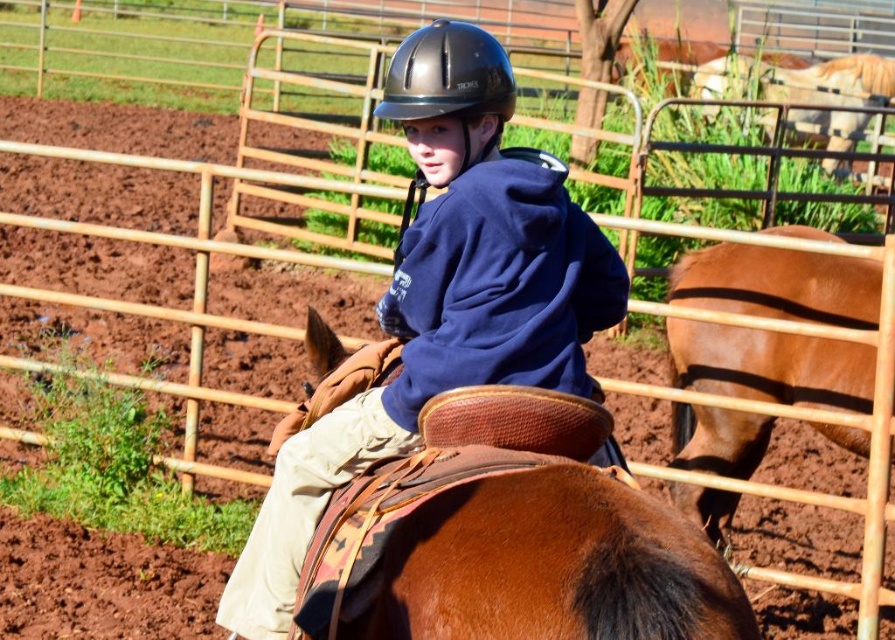
Question: Which object is the farthest from the glossy black helmet at center?

Choices:
 (A) matte black helmet at center
 (B) brown leather saddle at center

Answer: (B)

Question: Can you confirm if brown leather horse at right is positioned above glossy black helmet at center?

Choices:
 (A) yes
 (B) no

Answer: (B)

Question: Estimate the real-world distances between objects in this image. Which object is closer to the brown leather saddle at center?

Choices:
 (A) matte black helmet at center
 (B) brown leather horse at right
 (C) glossy black helmet at center

Answer: (A)

Question: Is matte black helmet at center smaller than brown leather horse at right?

Choices:
 (A) no
 (B) yes

Answer: (B)

Question: Does matte black helmet at center appear on the right side of brown leather horse at right?

Choices:
 (A) no
 (B) yes

Answer: (A)

Question: Which object is the closest to the brown leather saddle at center?

Choices:
 (A) brown leather horse at right
 (B) matte black helmet at center

Answer: (B)